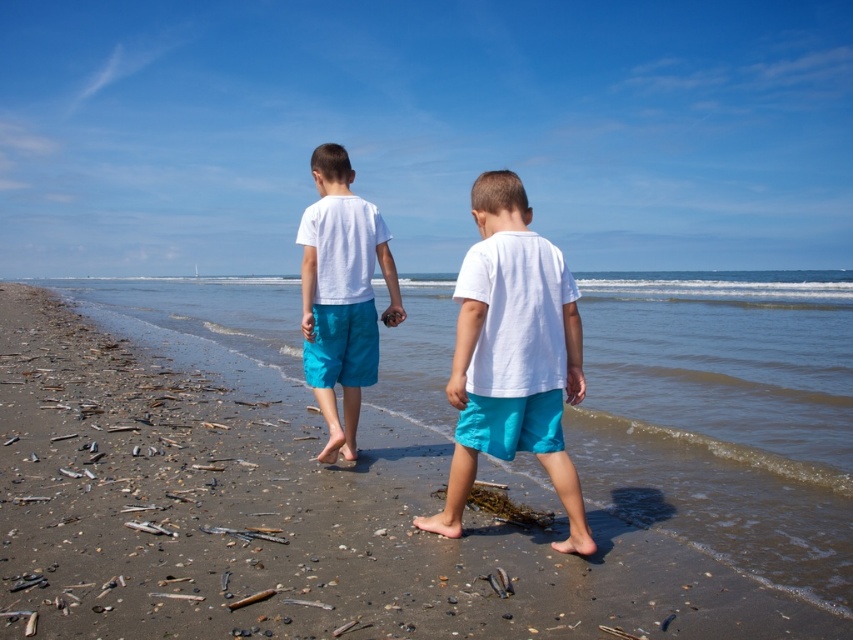
From the picture: You are a photographer trying to capture the two boys walking on the beach. You want to ensure the white matte shorts at center and the smooth sand at center are both clearly visible in your shot. Which object should you focus on to ensure both are in frame?

The smooth sand at center might be wider than white matte shorts at center, so focusing on the smooth sand at center would ensure both objects are within the frame since it occupies more space.